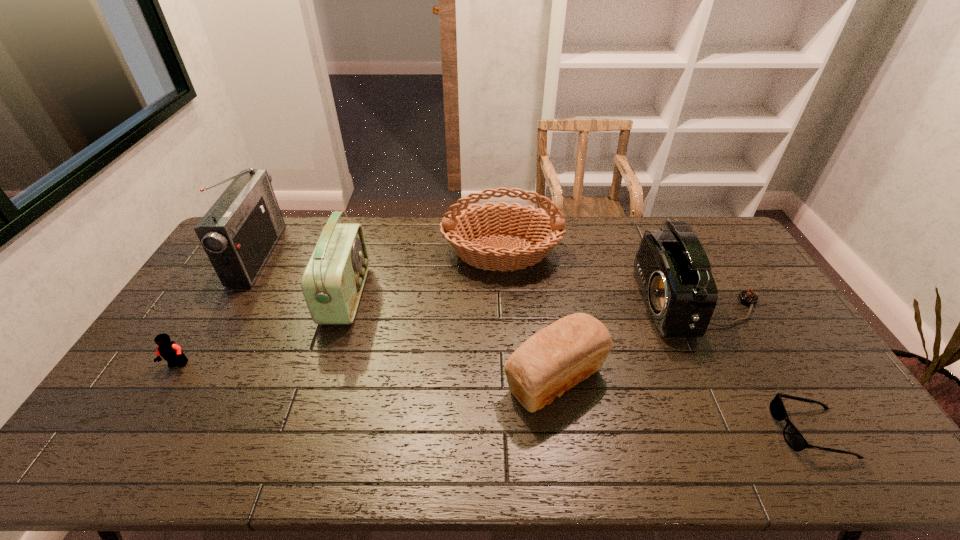
Locate an element on the screen. This screenshot has height=540, width=960. free space at the right edge of the desktop is located at coordinates (794, 356).

At what (x,y) coordinates should I click in order to perform the action: click on free space at the near right corner of the desktop. Please return your answer as a coordinate pair (x, y). This screenshot has width=960, height=540. Looking at the image, I should click on (849, 462).

This screenshot has height=540, width=960. What are the coordinates of `vacant space that's between the tallest object and the rightmost radio receiver` in the screenshot? It's located at (478, 279).

At what (x,y) coordinates should I click in order to perform the action: click on empty location between the shortest object and the sixth tallest object. Please return your answer as a coordinate pair (x, y). Looking at the image, I should click on (494, 398).

Find the location of a particular element. unoccupied area between the fifth tallest object and the second radio receiver from right to left is located at coordinates (450, 338).

Where is `free space between the fifth tallest object and the shortest object`? The image size is (960, 540). free space between the fifth tallest object and the shortest object is located at coordinates (683, 405).

What are the coordinates of `vacant region between the sixth tallest object and the bread` in the screenshot? It's located at (367, 372).

Image resolution: width=960 pixels, height=540 pixels. I want to click on free point between the tallest object and the rightmost radio receiver, so click(x=478, y=279).

Find the location of a particular element. vacant space that is in between the rightmost radio receiver and the second shortest object is located at coordinates (439, 334).

Image resolution: width=960 pixels, height=540 pixels. Find the location of `free space between the leftmost radio receiver and the fifth object from right to left`. free space between the leftmost radio receiver and the fifth object from right to left is located at coordinates (301, 275).